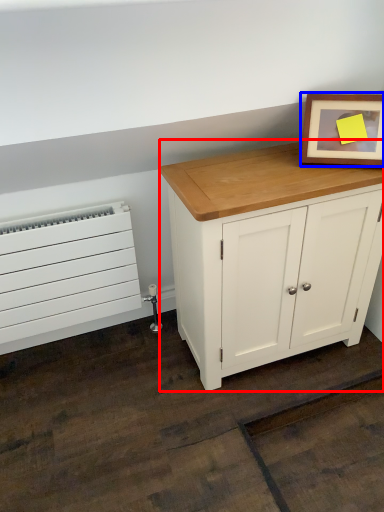
Question: Which point is further to the camera, chest of drawers (highlighted by a red box) or picture frame (highlighted by a blue box)?

Choices:
 (A) chest of drawers
 (B) picture frame

Answer: (B)